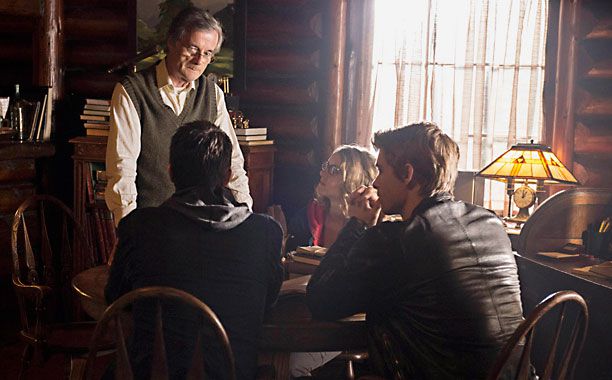
Find the location of a particular element. This screenshot has height=380, width=612. curtains is located at coordinates (406, 56), (490, 58).